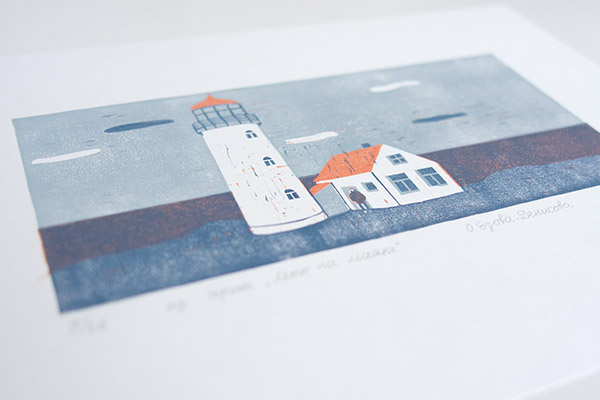
Locate an element on the screen. cottage windows is located at coordinates (368, 185), (395, 157), (402, 181), (429, 177).